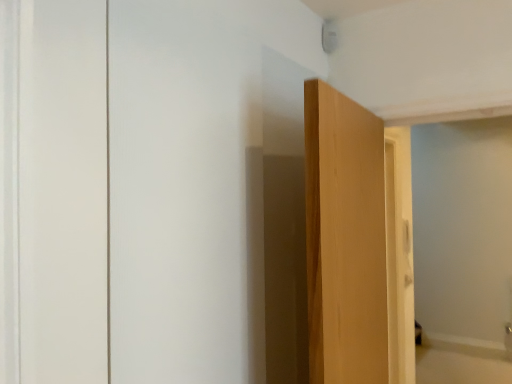
Question: From the image's perspective, would you say beige wood bathtub at lower right is shown under light brown wood door at center?

Choices:
 (A) no
 (B) yes

Answer: (B)

Question: Is beige wood bathtub at lower right positioned before light brown wood door at center?

Choices:
 (A) yes
 (B) no

Answer: (B)

Question: From the image's perspective, is beige wood bathtub at lower right on top of light brown wood door at center?

Choices:
 (A) no
 (B) yes

Answer: (A)

Question: Considering the relative sizes of beige wood bathtub at lower right and light brown wood door at center in the image provided, is beige wood bathtub at lower right smaller than light brown wood door at center?

Choices:
 (A) yes
 (B) no

Answer: (A)

Question: Does beige wood bathtub at lower right turn towards light brown wood door at center?

Choices:
 (A) yes
 (B) no

Answer: (B)

Question: Is beige wood bathtub at lower right with light brown wood door at center?

Choices:
 (A) yes
 (B) no

Answer: (B)

Question: Is light brown wood door at center next to beige wood bathtub at lower right?

Choices:
 (A) no
 (B) yes

Answer: (A)

Question: Is light brown wood door at center taller than beige wood bathtub at lower right?

Choices:
 (A) no
 (B) yes

Answer: (B)

Question: Is light brown wood door at center to the right of beige wood bathtub at lower right from the viewer's perspective?

Choices:
 (A) no
 (B) yes

Answer: (A)

Question: Considering the relative sizes of light brown wood door at center and beige wood bathtub at lower right in the image provided, is light brown wood door at center bigger than beige wood bathtub at lower right?

Choices:
 (A) yes
 (B) no

Answer: (A)

Question: Is light brown wood door at center positioned behind beige wood bathtub at lower right?

Choices:
 (A) yes
 (B) no

Answer: (B)

Question: Is light brown wood door at center turned away from beige wood bathtub at lower right?

Choices:
 (A) no
 (B) yes

Answer: (A)

Question: In the image, is light brown wood door at center positioned in front of or behind beige wood bathtub at lower right?

Choices:
 (A) behind
 (B) front

Answer: (B)